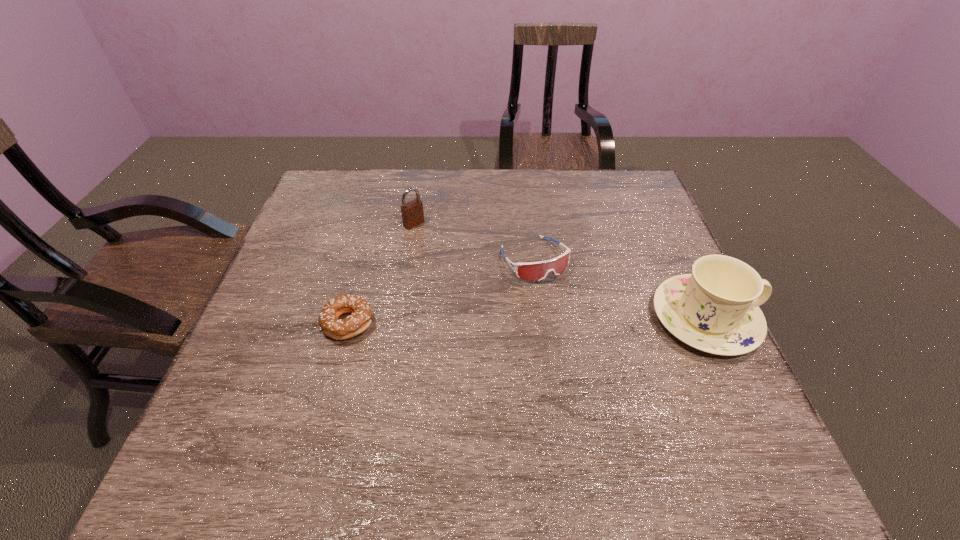
Locate an element on the screen. object that is the second closest to the rightmost object is located at coordinates (412, 212).

The image size is (960, 540). I want to click on vacant space that satisfies the following two spatial constraints: 1. on the front side of the goggles; 2. on the handle side of the chinaware, so click(x=542, y=319).

Where is `blank space that satisfies the following two spatial constraints: 1. on the front side of the chinaware; 2. on the handle side of the second object from left to right`? blank space that satisfies the following two spatial constraints: 1. on the front side of the chinaware; 2. on the handle side of the second object from left to right is located at coordinates (398, 319).

At what (x,y) coordinates should I click in order to perform the action: click on vacant space that satisfies the following two spatial constraints: 1. on the front side of the third tallest object; 2. on the handle side of the rightmost object. Please return your answer as a coordinate pair (x, y). This screenshot has height=540, width=960. Looking at the image, I should click on (542, 319).

The width and height of the screenshot is (960, 540). Find the location of `vacant point that satisfies the following two spatial constraints: 1. on the back side of the doughnut; 2. on the handle side of the rightmost object`. vacant point that satisfies the following two spatial constraints: 1. on the back side of the doughnut; 2. on the handle side of the rightmost object is located at coordinates (349, 319).